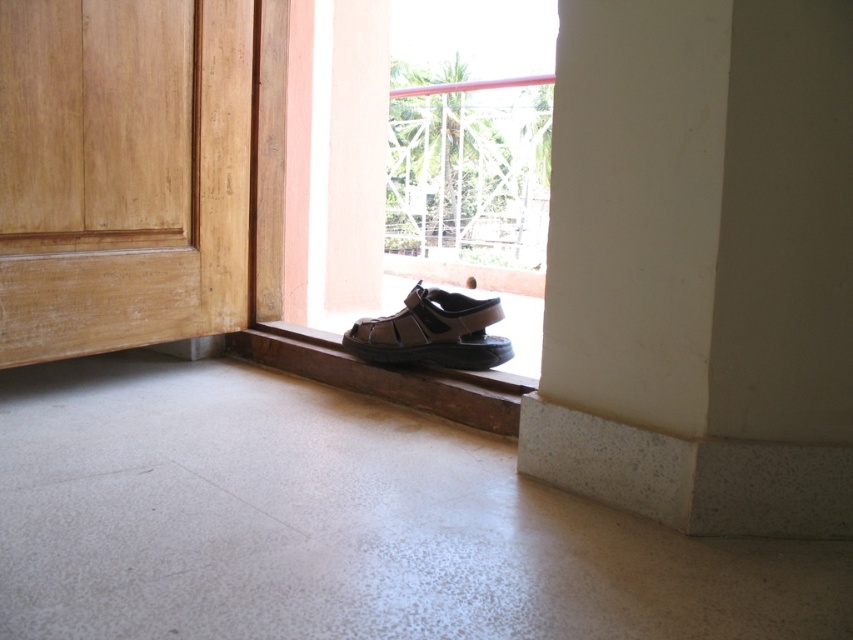
At what (x,y) coordinates should I click in order to perform the action: click on white textured pillar at lower right. Please return your answer as a coordinate pair (x, y). This screenshot has width=853, height=640. Looking at the image, I should click on (700, 266).

Can you confirm if white textured pillar at lower right is taller than brown leather sandal at lower center?

Correct, white textured pillar at lower right is much taller as brown leather sandal at lower center.

This screenshot has width=853, height=640. What do you see at coordinates (700, 266) in the screenshot?
I see `white textured pillar at lower right` at bounding box center [700, 266].

This screenshot has height=640, width=853. I want to click on white textured pillar at lower right, so click(x=700, y=266).

Does light brown wood door at lower left appear on the left side of brown leather sandal at lower center?

Indeed, light brown wood door at lower left is positioned on the left side of brown leather sandal at lower center.

Is light brown wood door at lower left further to the viewer compared to brown leather sandal at lower center?

No, light brown wood door at lower left is closer to the viewer.

Who is more distant from viewer, (136, 339) or (489, 360)?

Point (136, 339)

Locate an element on the screen. This screenshot has width=853, height=640. light brown wood door at lower left is located at coordinates (120, 172).

Between white textured pillar at lower right and light brown wood door at lower left, which one appears on the right side from the viewer's perspective?

white textured pillar at lower right

Does white textured pillar at lower right appear over light brown wood door at lower left?

No.

You are a GUI agent. You are given a task and a screenshot of the screen. Output one action in this format:
    pyautogui.click(x=<x>, y=<y>)
    Task: Click on the white textured pillar at lower right
    The width and height of the screenshot is (853, 640).
    Given the screenshot: What is the action you would take?
    pyautogui.click(x=700, y=266)